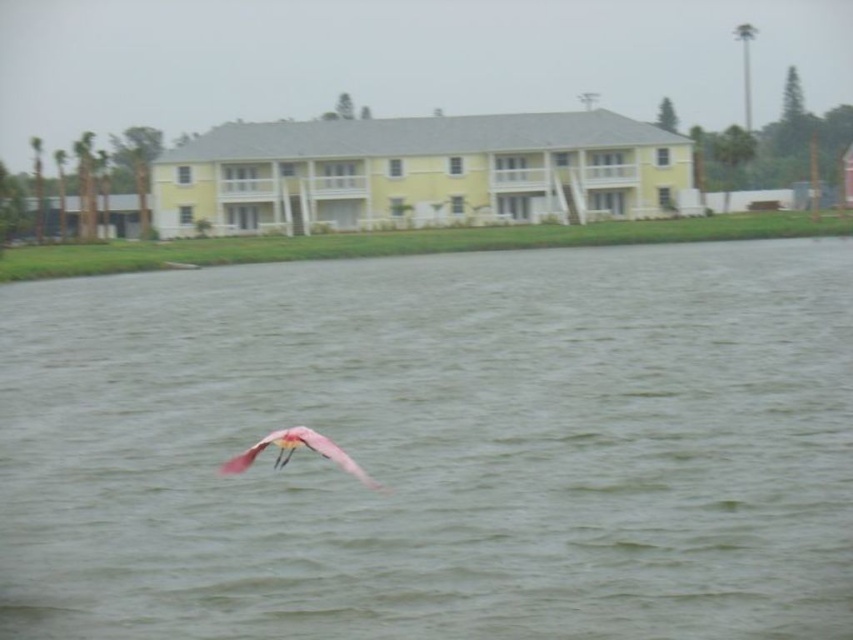
You are standing at the edge of the water and want to reach the green water at center. Based on the coordinates provided, in which direction should you move relative to your current position?

The green water at center is located at coordinates point (434, 445). Since you are at the edge, you should move towards the center of the image to reach it.

Consider the image. You are standing on the dock and see the green water at center and the pink feathered bird at center. Which object is closer to you?

The green water at center is closer to you because the pink feathered bird at center is behind it.

Looking at this image, you are a photographer trying to capture the pink feathered bird at center while avoiding the green water at center in the foreground. Can you adjust your camera angle to ensure the bird is fully visible without the water blocking it?

The green water at center is taller than the pink feathered bird at center, so adjusting the camera angle upward might allow the bird to be fully visible without the water blocking it.